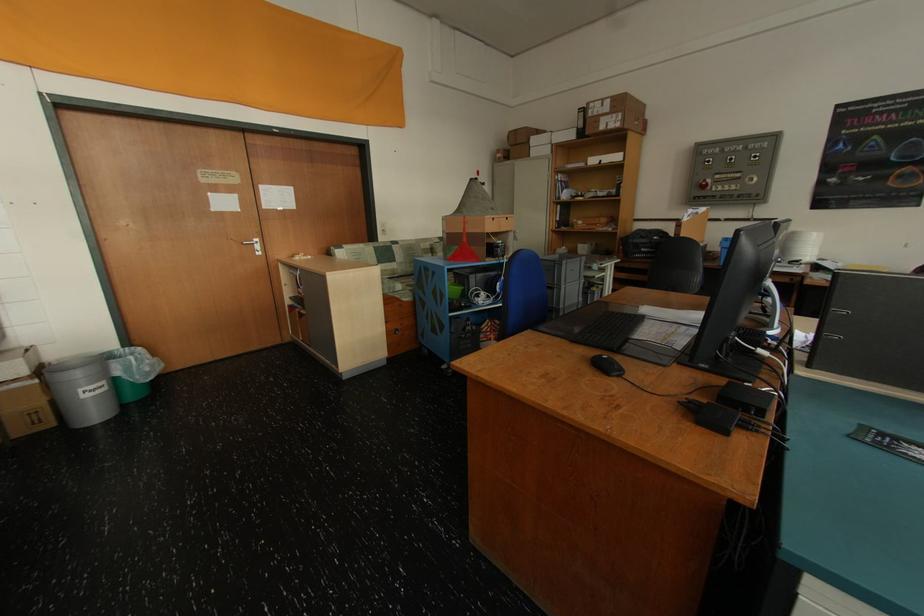
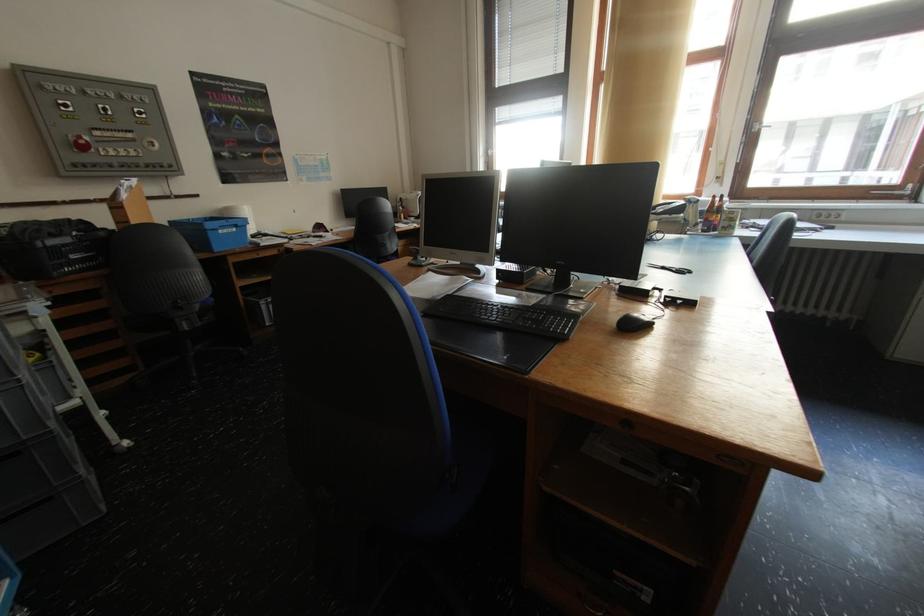
Where in the second image is the point corresponding to (x=714, y=164) from the first image?

(71, 110)